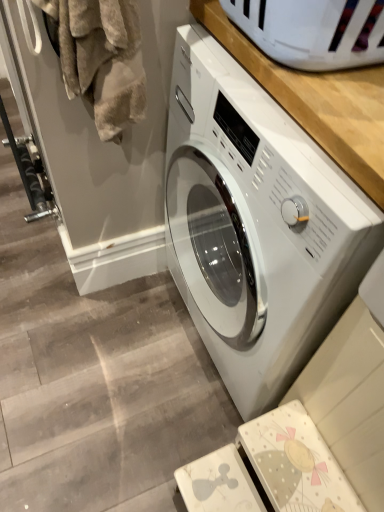
Describe the element at coordinates (102, 59) in the screenshot. I see `fuzzy beige towel at left` at that location.

You are a GUI agent. You are given a task and a screenshot of the screen. Output one action in this format:
    pyautogui.click(x=<x>, y=<y>)
    Task: Click on the fuzzy beige towel at left
    This screenshot has width=384, height=512.
    Given the screenshot: What is the action you would take?
    pyautogui.click(x=102, y=59)

Measure the distance between point (140,104) and camera.

Point (140,104) and camera are 32.76 inches apart.

Identify the location of white glossy washing machine at center. This screenshot has width=384, height=512. (256, 225).

What do you see at coordinates (256, 225) in the screenshot? The image size is (384, 512). I see `white glossy washing machine at center` at bounding box center [256, 225].

Where is `fuzzy beige towel at left`? fuzzy beige towel at left is located at coordinates (102, 59).

Is white glossy washing machine at center to the right of fuzzy beige towel at left from the viewer's perspective?

Correct, you'll find white glossy washing machine at center to the right of fuzzy beige towel at left.

Is white glossy washing machine at center positioned behind fuzzy beige towel at left?

No, it is not.

Does point (355, 253) come behind point (126, 89)?

No, (355, 253) is closer to viewer.

From the image's perspective, is white glossy washing machine at center positioned above or below fuzzy beige towel at left?

white glossy washing machine at center is below fuzzy beige towel at left.

From a real-world perspective, between white glossy washing machine at center and fuzzy beige towel at left, who is vertically lower?

In real-world perspective, white glossy washing machine at center is lower.

Does white glossy washing machine at center have a lesser width compared to fuzzy beige towel at left?

Incorrect, the width of white glossy washing machine at center is not less than that of fuzzy beige towel at left.

Is white glossy washing machine at center taller than fuzzy beige towel at left?

Indeed, white glossy washing machine at center has a greater height compared to fuzzy beige towel at left.

Is white glossy washing machine at center bigger or smaller than fuzzy beige towel at left?

A: white glossy washing machine at center is bigger than fuzzy beige towel at left.

Is white glossy washing machine at center located outside fuzzy beige towel at left?

white glossy washing machine at center is positioned outside fuzzy beige towel at left.

Is there a large distance between white glossy washing machine at center and fuzzy beige towel at left?

No, white glossy washing machine at center is not far away from fuzzy beige towel at left.

Is white glossy washing machine at center aimed at fuzzy beige towel at left?

Yes, white glossy washing machine at center is aimed at fuzzy beige towel at left.

Consider the image. How different are the orientations of white glossy washing machine at center and fuzzy beige towel at left in degrees?

90.8 degrees separate the facing orientations of white glossy washing machine at center and fuzzy beige towel at left.

How far apart are white glossy washing machine at center and fuzzy beige towel at left?

12.14 inches.

Identify the location of laundry on the left of white glossy washing machine at center. (102, 59).

Looking at this image, which is more to the right, fuzzy beige towel at left or white glossy washing machine at center?

Positioned to the right is white glossy washing machine at center.

Relative to white glossy washing machine at center, is fuzzy beige towel at left in front or behind?

fuzzy beige towel at left is positioned farther from the viewer than white glossy washing machine at center.

Is point (139, 63) positioned in front of point (311, 164)?

No.

From the image's perspective, who appears lower, fuzzy beige towel at left or white glossy washing machine at center?

white glossy washing machine at center is shown below in the image.

From a real-world perspective, does fuzzy beige towel at left stand above white glossy washing machine at center?

Indeed, from a real-world perspective, fuzzy beige towel at left stands above white glossy washing machine at center.

Looking at their sizes, would you say fuzzy beige towel at left is wider or thinner than white glossy washing machine at center?

Clearly, fuzzy beige towel at left has less width compared to white glossy washing machine at center.

In terms of height, does fuzzy beige towel at left look taller or shorter compared to white glossy washing machine at center?

In the image, fuzzy beige towel at left appears to be shorter than white glossy washing machine at center.

Considering the sizes of fuzzy beige towel at left and white glossy washing machine at center in the image, is fuzzy beige towel at left bigger or smaller than white glossy washing machine at center?

Clearly, fuzzy beige towel at left is smaller in size than white glossy washing machine at center.

Is white glossy washing machine at center a part of fuzzy beige towel at left?

No.

Is fuzzy beige towel at left touching white glossy washing machine at center?

There is a gap between fuzzy beige towel at left and white glossy washing machine at center.

Does fuzzy beige towel at left turn towards white glossy washing machine at center?

No, fuzzy beige towel at left is not oriented towards white glossy washing machine at center.

Measure the distance between fuzzy beige towel at left and white glossy washing machine at center.

They are 12.14 inches apart.

You are a GUI agent. You are given a task and a screenshot of the screen. Output one action in this format:
    pyautogui.click(x=<x>, y=<y>)
    Task: Click on the washing machine to the right of fuzzy beige towel at left
    The width and height of the screenshot is (384, 512).
    Given the screenshot: What is the action you would take?
    pyautogui.click(x=256, y=225)

The image size is (384, 512). What are the coordinates of `washing machine that appears below the fuzzy beige towel at left (from a real-world perspective)` in the screenshot? It's located at (256, 225).

Where is `laundry to the left of white glossy washing machine at center`? The width and height of the screenshot is (384, 512). laundry to the left of white glossy washing machine at center is located at coordinates (102, 59).